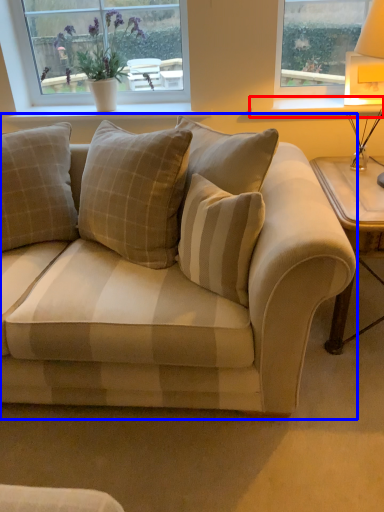
Question: Among these objects, which one is nearest to the camera, window sill (highlighted by a red box) or studio couch (highlighted by a blue box)?

Choices:
 (A) window sill
 (B) studio couch

Answer: (B)